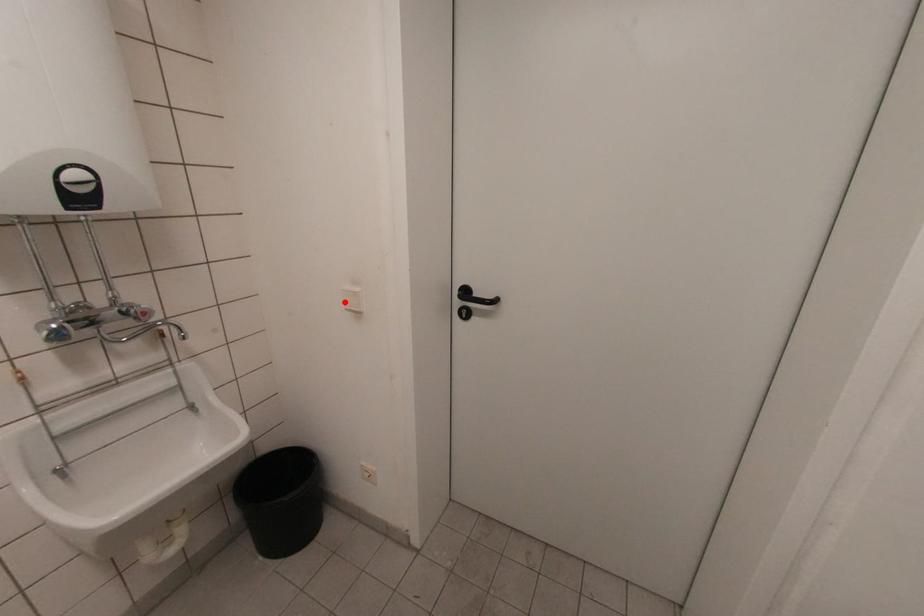
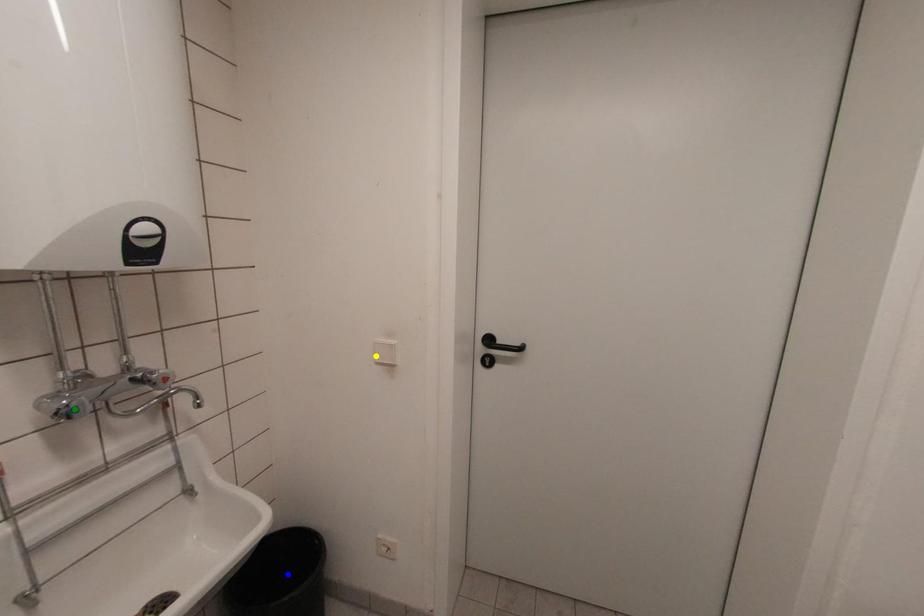
Question: I am providing you with two images of the same scene from different viewpoints. A red point is marked on the first image. You are given multiple points on the second image. Which point in image 2 represents the same 3d spot as the red point in image 1?

Choices:
 (A) yellow point
 (B) green point
 (C) blue point

Answer: (A)